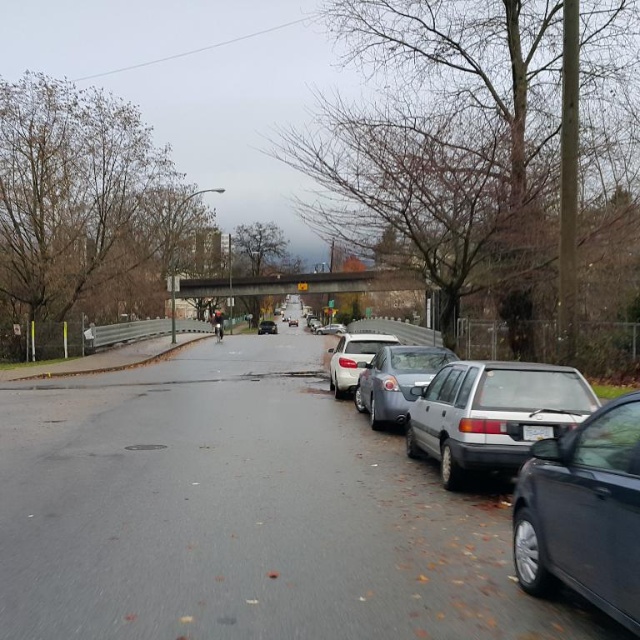
Question: Can you confirm if white matte sedan at center is positioned to the right of silver metallic sedan at center?

Choices:
 (A) no
 (B) yes

Answer: (B)

Question: Which is nearer to the white matte sedan at center?

Choices:
 (A) shiny silver sedan at center
 (B) white plastic license plate at center
 (C) silver metallic hatchback at right
 (D) satin white sedan at center

Answer: (A)

Question: Which point appears closest to the camera in this image?

Choices:
 (A) (467, 378)
 (B) (333, 330)
 (C) (289, 321)

Answer: (A)

Question: From the image, what is the correct spatial relationship of silver metallic hatchback at right in relation to white plastic license plate at center?

Choices:
 (A) right
 (B) left

Answer: (B)

Question: Which is nearer to the shiny silver sedan at center?

Choices:
 (A) white matte sedan at center
 (B) shiny black sedan at right
 (C) silver metallic hatchback at right

Answer: (A)

Question: Is white matte sedan at center above silver metallic sedan at center?

Choices:
 (A) yes
 (B) no

Answer: (B)